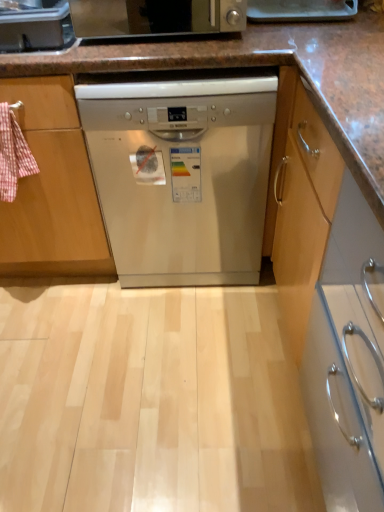
Question: Should I look upward or downward to see satin silver dishwasher at center?

Choices:
 (A) down
 (B) up

Answer: (B)

Question: Is satin silver dishwasher at center located within satin silver toaster at upper center?

Choices:
 (A) no
 (B) yes

Answer: (A)

Question: Is satin silver toaster at upper center to the left of satin silver dishwasher at center from the viewer's perspective?

Choices:
 (A) yes
 (B) no

Answer: (A)

Question: Is satin silver toaster at upper center wider than satin silver dishwasher at center?

Choices:
 (A) no
 (B) yes

Answer: (A)

Question: Is satin silver toaster at upper center completely or partially outside of satin silver dishwasher at center?

Choices:
 (A) no
 (B) yes

Answer: (B)

Question: Does satin silver toaster at upper center appear on the right side of satin silver dishwasher at center?

Choices:
 (A) no
 (B) yes

Answer: (A)

Question: From a real-world perspective, is satin silver toaster at upper center on top of satin silver dishwasher at center?

Choices:
 (A) no
 (B) yes

Answer: (B)

Question: Is satin silver toaster at upper left wider than satin silver toaster at upper center?

Choices:
 (A) yes
 (B) no

Answer: (B)

Question: Is satin silver toaster at upper left outside of satin silver toaster at upper center?

Choices:
 (A) yes
 (B) no

Answer: (A)

Question: From the image's perspective, would you say satin silver toaster at upper left is shown under satin silver toaster at upper center?

Choices:
 (A) yes
 (B) no

Answer: (A)

Question: Can you confirm if satin silver toaster at upper left is smaller than satin silver toaster at upper center?

Choices:
 (A) no
 (B) yes

Answer: (B)

Question: Can you confirm if satin silver toaster at upper left is positioned to the right of satin silver toaster at upper center?

Choices:
 (A) no
 (B) yes

Answer: (A)

Question: Is satin silver toaster at upper center at the back of satin silver toaster at upper left?

Choices:
 (A) yes
 (B) no

Answer: (B)

Question: Does satin silver toaster at upper center appear on the left side of satin silver toaster at upper left?

Choices:
 (A) yes
 (B) no

Answer: (B)